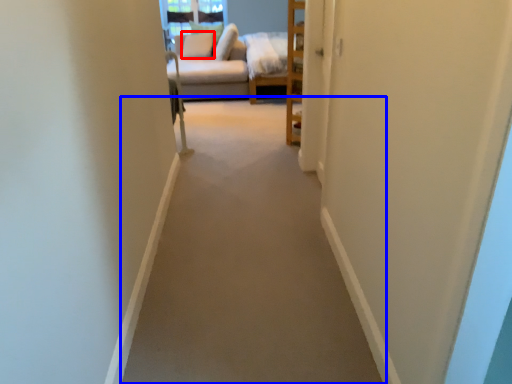
Question: Among these objects, which one is farthest to the camera, pillow (highlighted by a red box) or path (highlighted by a blue box)?

Choices:
 (A) pillow
 (B) path

Answer: (A)